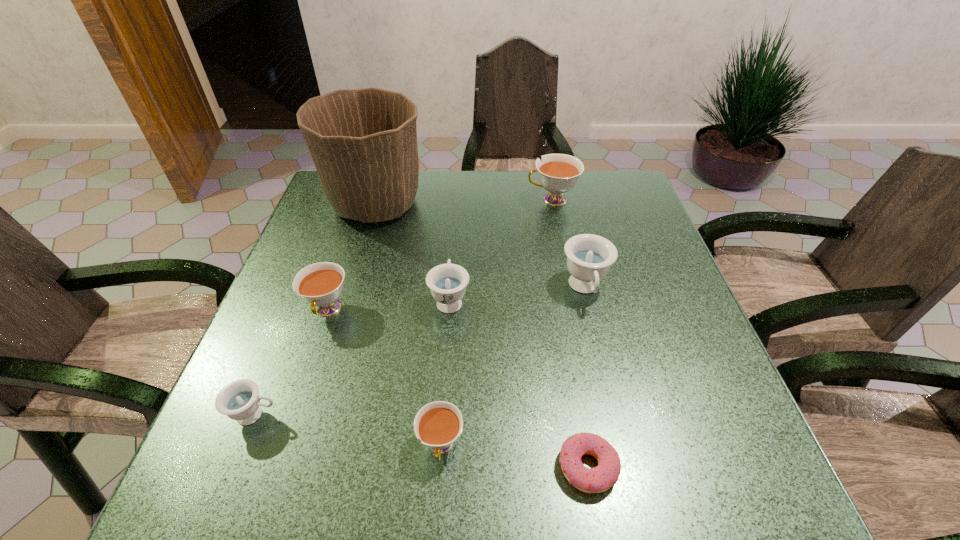
Where is `free point between the flowerpot and the second blue teacup from right to left`? The height and width of the screenshot is (540, 960). free point between the flowerpot and the second blue teacup from right to left is located at coordinates (413, 252).

Image resolution: width=960 pixels, height=540 pixels. In order to click on vacant area between the smallest white teacup and the smallest blue teacup in this screenshot , I will do `click(348, 430)`.

Where is `vacant space that's between the biggest white teacup and the pink doughnut`? The image size is (960, 540). vacant space that's between the biggest white teacup and the pink doughnut is located at coordinates (570, 333).

Locate an element on the screen. Image resolution: width=960 pixels, height=540 pixels. vacant space that's between the leftmost white teacup and the farthest teacup is located at coordinates (440, 255).

Find the location of a particular element. This screenshot has height=540, width=960. vacant area that lies between the second smallest blue teacup and the farthest white teacup is located at coordinates (501, 249).

Image resolution: width=960 pixels, height=540 pixels. Find the location of `free space between the doughnut and the second biggest white teacup`. free space between the doughnut and the second biggest white teacup is located at coordinates (458, 389).

The height and width of the screenshot is (540, 960). What are the coordinates of `free space that is in between the rightmost white teacup and the nearest blue teacup` in the screenshot? It's located at (403, 307).

At what (x,y) coordinates should I click in order to perform the action: click on empty location between the doughnut and the second smallest white teacup. Please return your answer as a coordinate pair (x, y). The image size is (960, 540). Looking at the image, I should click on [458, 389].

I want to click on object that is the second closest to the tallest object, so [320, 284].

Identify which object is located as the fifth nearest to the biggest white teacup. Please provide its 2D coordinates. Your answer should be formatted as a tuple, i.e. [(x, y)], where the tuple contains the x and y coordinates of a point satisfying the conditions above.

[(438, 424)]